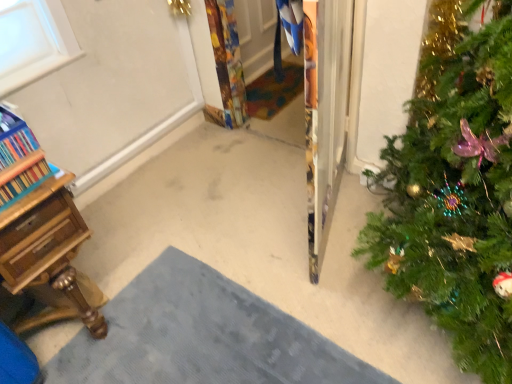
Question: In terms of height, does wooden desk at lower left look taller or shorter compared to multicolored woven mat at center, which is the 1th doormat in top-to-bottom order?

Choices:
 (A) short
 (B) tall

Answer: (B)

Question: In terms of size, does wooden desk at lower left appear bigger or smaller than multicolored woven mat at center, which is the first doormat from back to front?

Choices:
 (A) big
 (B) small

Answer: (A)

Question: Estimate the real-world distances between objects in this image. Which object is closer to the gray textured doormat at lower center, arranged as the second doormat when viewed from the top?

Choices:
 (A) multicolored woven mat at center, which is the first doormat from back to front
 (B) green matte christmas tree at right
 (C) wooden bookcase at left
 (D) wooden desk at lower left

Answer: (D)

Question: Considering the real-world distances, which object is farthest from the wooden bookcase at left?

Choices:
 (A) multicolored woven mat at center, the 2th doormat from the front
 (B) wooden desk at lower left
 (C) green matte christmas tree at right
 (D) gray textured doormat at lower center, the 1th doormat when ordered from front to back

Answer: (A)